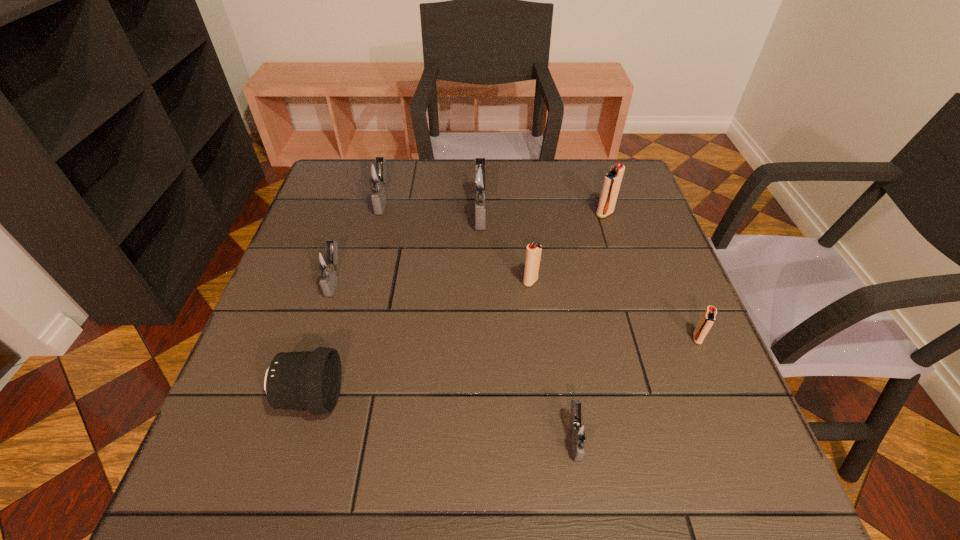
Identify the location of the rightmost red igniter. This screenshot has width=960, height=540. (706, 322).

I want to click on the nearest igniter, so click(579, 432).

Where is `the smallest gray igniter`? This screenshot has height=540, width=960. the smallest gray igniter is located at coordinates [x=579, y=432].

Find the location of a particular element. free space located on the right of the fourth object from left to right is located at coordinates (643, 212).

I want to click on free spot located 0.210m on the left of the second red igniter from left to right, so tap(518, 214).

Identify the location of free space located on the left of the second biggest gray igniter. The height and width of the screenshot is (540, 960). (341, 200).

Locate an element on the screen. vacant space positioned 0.100m on the back of the third farthest gray igniter is located at coordinates (348, 235).

Locate an element on the screen. This screenshot has height=540, width=960. vacant space situated 0.300m on the front of the second farthest red igniter is located at coordinates (544, 408).

What are the coordinates of `vacant region located at the front element of the telephoto lens` in the screenshot? It's located at (479, 397).

Find the location of a particular element. This screenshot has width=960, height=540. vacant space located on the front of the smallest red igniter is located at coordinates (757, 482).